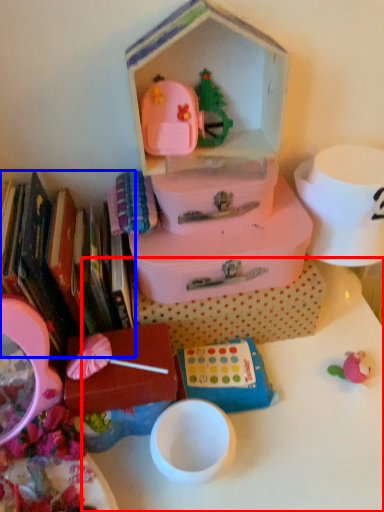
Question: Which of the following is the closest to the observer, table (highlighted by a red box) or book (highlighted by a blue box)?

Choices:
 (A) table
 (B) book

Answer: (B)